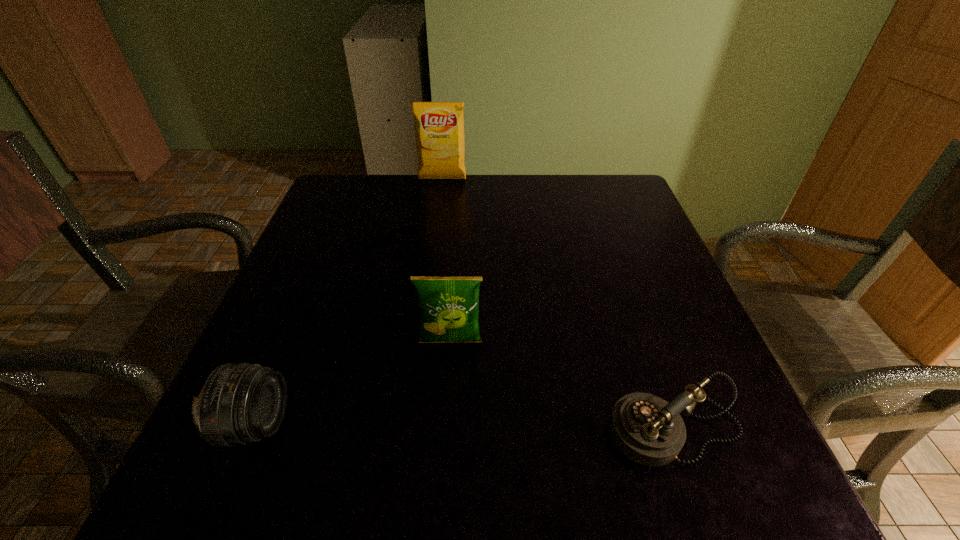
I want to click on the tallest object, so click(x=439, y=126).

Find the location of a particular element. The height and width of the screenshot is (540, 960). the taller crisp (potato chip) is located at coordinates (439, 126).

Find the location of a particular element. This screenshot has height=540, width=960. the second farthest object is located at coordinates (449, 306).

You are a GUI agent. You are given a task and a screenshot of the screen. Output one action in this format:
    pyautogui.click(x=<x>, y=<y>)
    Task: Click on the second tallest object
    The height and width of the screenshot is (540, 960).
    Given the screenshot: What is the action you would take?
    pyautogui.click(x=449, y=306)

Locate an element on the screen. Image resolution: width=960 pixels, height=540 pixels. the leftmost object is located at coordinates (239, 403).

The width and height of the screenshot is (960, 540). In order to click on telephone in this screenshot , I will do `click(647, 429)`.

Locate an element on the screen. This screenshot has width=960, height=540. vacant space situated 0.210m on the front of the farthest object with the logo is located at coordinates (436, 228).

Identify the location of vacant space located on the front-facing side of the second farthest object. (448, 385).

At what (x,y) coordinates should I click in order to perform the action: click on free space located at the front element of the leftmost object. Please return your answer as a coordinate pair (x, y). Image resolution: width=960 pixels, height=540 pixels. Looking at the image, I should click on (461, 424).

You are a GUI agent. You are given a task and a screenshot of the screen. Output one action in this format:
    pyautogui.click(x=<x>, y=<y>)
    Task: Click on the vacant area situated on the left of the rightmost object
    The height and width of the screenshot is (540, 960).
    Given the screenshot: What is the action you would take?
    tap(412, 429)